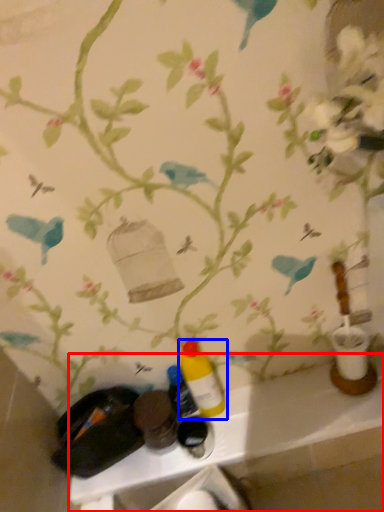
Question: Which of the following is the closest to the observer, counter (highlighted by a red box) or bottle (highlighted by a blue box)?

Choices:
 (A) counter
 (B) bottle

Answer: (B)